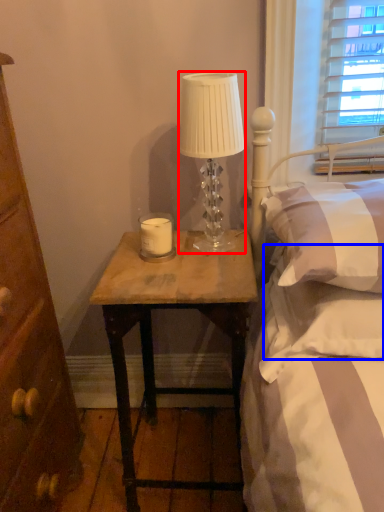
Question: Which object appears farthest to the camera in this image, lamp (highlighted by a red box) or pillow (highlighted by a blue box)?

Choices:
 (A) lamp
 (B) pillow

Answer: (A)